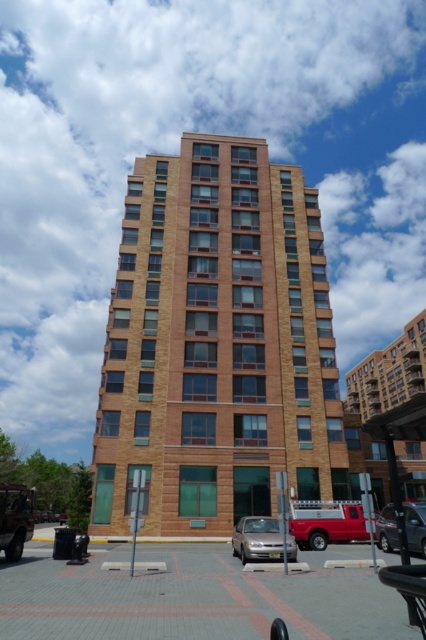
Question: Where is matte black suv at lower left located in relation to metallic silver car at center in the image?

Choices:
 (A) above
 (B) below

Answer: (A)

Question: Among these points, which one is nearest to the camera?

Choices:
 (A) (147, 333)
 (B) (393, 516)
 (C) (337, 502)

Answer: (B)

Question: Is brown brick building at center positioned at the back of matte red truck at lower center?

Choices:
 (A) yes
 (B) no

Answer: (B)

Question: Among these points, which one is nearest to the camera?

Choices:
 (A) (408, 534)
 (B) (273, 228)

Answer: (A)

Question: Is brown brick building at center positioned at the back of matte black suv at lower left?

Choices:
 (A) yes
 (B) no

Answer: (A)

Question: Which object is farther from the camera taking this photo?

Choices:
 (A) metallic silver car at center
 (B) matte red truck at lower center
 (C) matte black suv at lower left

Answer: (B)